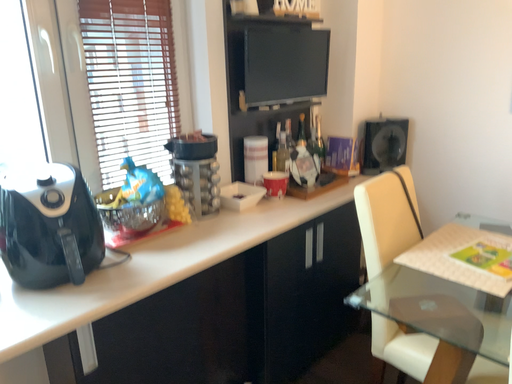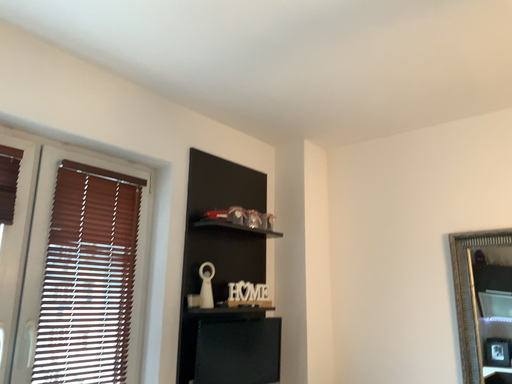
Question: How did the camera likely rotate when shooting the video?

Choices:
 (A) rotated upward
 (B) rotated downward

Answer: (A)